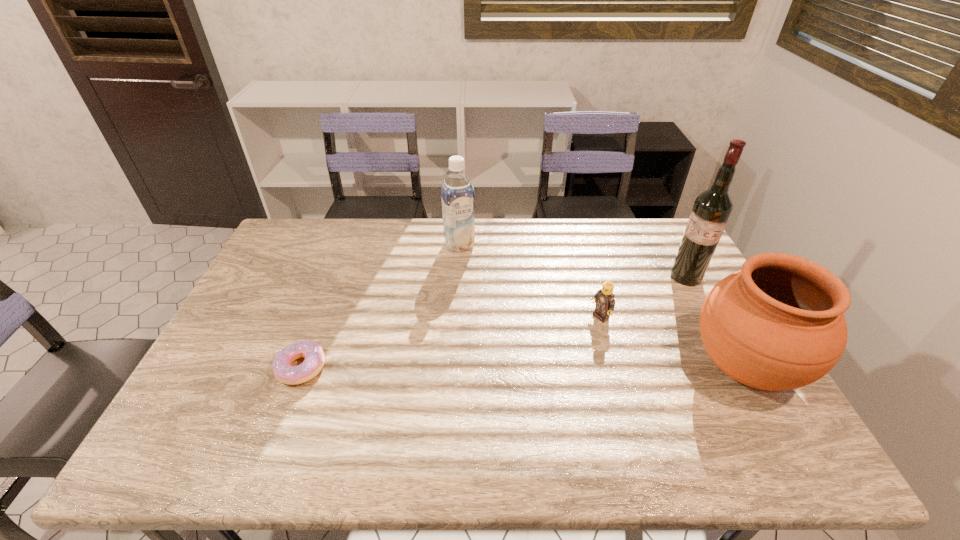
Identify the location of vacant space on the desktop that is between the doughnut and the pottery and is positioned on the label of the farthest object. This screenshot has width=960, height=540. (523, 367).

Where is `vacant spot on the desktop that is between the shortest object and the pottery and is positioned in front of the third object from right to left`? vacant spot on the desktop that is between the shortest object and the pottery and is positioned in front of the third object from right to left is located at coordinates (518, 367).

At what (x,y) coordinates should I click in order to perform the action: click on vacant space on the desktop that is between the leftmost object and the pottery and is positioned on the front and back of the wine bottle. Please return your answer as a coordinate pair (x, y). Image resolution: width=960 pixels, height=540 pixels. Looking at the image, I should click on (553, 367).